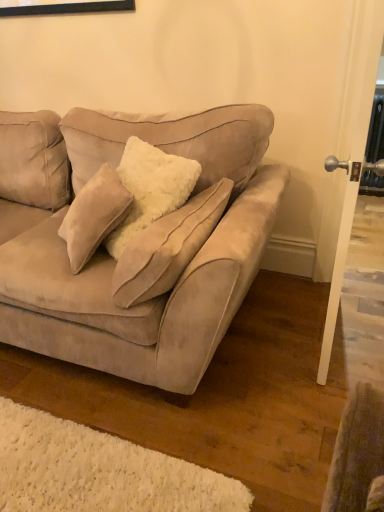
Question: Considering the relative positions of suede beige couch at center and white glossy door handle at right in the image provided, is suede beige couch at center to the left or to the right of white glossy door handle at right?

Choices:
 (A) left
 (B) right

Answer: (A)

Question: Considering the positions of suede beige couch at center and white glossy door handle at right in the image, is suede beige couch at center taller or shorter than white glossy door handle at right?

Choices:
 (A) short
 (B) tall

Answer: (A)

Question: From the image's perspective, relative to white glossy door handle at right, is suede beige couch at center above or below?

Choices:
 (A) above
 (B) below

Answer: (B)

Question: Considering the positions of point (352, 32) and point (26, 266), is point (352, 32) closer or farther from the camera than point (26, 266)?

Choices:
 (A) closer
 (B) farther

Answer: (B)

Question: In terms of height, does white glossy door handle at right look taller or shorter compared to suede beige couch at center?

Choices:
 (A) short
 (B) tall

Answer: (B)

Question: From the image's perspective, is white glossy door handle at right positioned above or below suede beige couch at center?

Choices:
 (A) below
 (B) above

Answer: (B)

Question: From a real-world perspective, is white glossy door handle at right above or below suede beige couch at center?

Choices:
 (A) below
 (B) above

Answer: (B)